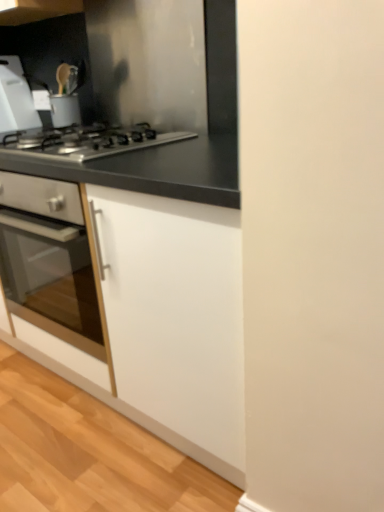
The image size is (384, 512). Describe the element at coordinates (144, 92) in the screenshot. I see `black matte countertop at upper left` at that location.

Locate an element on the screen. white plastic cutting board at upper left is located at coordinates click(15, 98).

From a real-world perspective, does white plastic cutting board at upper left stand above stainless steel gas stove at center?

Yes, from a real-world perspective, white plastic cutting board at upper left is over stainless steel gas stove at center

How different are the orientations of white plastic cutting board at upper left and stainless steel gas stove at center in degrees?

The facing directions of white plastic cutting board at upper left and stainless steel gas stove at center are 92.7 degrees apart.

Is white plastic cutting board at upper left surrounding stainless steel gas stove at center?

No, stainless steel gas stove at center is not a part of white plastic cutting board at upper left.

Can you confirm if white plastic cutting board at upper left is shorter than stainless steel gas stove at center?

No, white plastic cutting board at upper left is not shorter than stainless steel gas stove at center.

Consider the image. Considering the relative positions of white matte cabinet at center and white plastic cutting board at upper left in the image provided, is white matte cabinet at center to the right of white plastic cutting board at upper left from the viewer's perspective?

Yes.

Based on their sizes in the image, would you say white matte cabinet at center is bigger or smaller than white plastic cutting board at upper left?

Clearly, white matte cabinet at center is larger in size than white plastic cutting board at upper left.

Locate an element on the screen. cabinetry below the white plastic cutting board at upper left (from a real-world perspective) is located at coordinates click(142, 228).

Who is more distant, white matte cabinet at center or white plastic cutting board at upper left?

white plastic cutting board at upper left is more distant.

From the picture: Is stainless steel gas stove at center not within black matte countertop at upper left?

stainless steel gas stove at center is positioned outside black matte countertop at upper left.

Is stainless steel gas stove at center to the left or to the right of black matte countertop at upper left in the image?

stainless steel gas stove at center is to the left of black matte countertop at upper left.

From a real-world perspective, is stainless steel gas stove at center positioned over black matte countertop at upper left based on gravity?

No, from a real-world perspective, stainless steel gas stove at center is not on top of black matte countertop at upper left.

From a real-world perspective, is white plastic cutting board at upper left on white matte cabinet at center?

Indeed, from a real-world perspective, white plastic cutting board at upper left stands above white matte cabinet at center.

Does point (1, 69) appear closer or farther from the camera than point (226, 39)?

Clearly, point (1, 69) is more distant from the camera than point (226, 39).

Is white plastic cutting board at upper left beside white matte cabinet at center?

There is a gap between white plastic cutting board at upper left and white matte cabinet at center.

Which of these two, white plastic cutting board at upper left or white matte cabinet at center, stands shorter?

With less height is white plastic cutting board at upper left.

Based on the photo, which is in front, black matte countertop at upper left or white matte cabinet at center?

white matte cabinet at center is more forward.

Visually, is black matte countertop at upper left positioned to the left or to the right of white matte cabinet at center?

black matte countertop at upper left is positioned on white matte cabinet at center's right side.

Is white plastic cutting board at upper left facing towards black matte countertop at upper left?

Yes.

Measure the distance from white plastic cutting board at upper left to black matte countertop at upper left.

white plastic cutting board at upper left and black matte countertop at upper left are 20.18 inches apart from each other.

Is white plastic cutting board at upper left wider than black matte countertop at upper left?

Yes.

Can you tell me how much white matte cabinet at center and stainless steel gas stove at center differ in facing direction?

They differ by 0.453 degrees in their facing directions.

From the image's perspective, does white matte cabinet at center appear lower than stainless steel gas stove at center?

Indeed, from the image's perspective, white matte cabinet at center is shown beneath stainless steel gas stove at center.

Is stainless steel gas stove at center at the back of white matte cabinet at center?

No, white matte cabinet at center is not facing the opposite direction of stainless steel gas stove at center.

How much distance is there between white matte cabinet at center and stainless steel gas stove at center?

white matte cabinet at center and stainless steel gas stove at center are 13.13 inches apart.

What are the coordinates of `home appliance behind the stainless steel gas stove at center` in the screenshot? It's located at (15, 98).

Where is `home appliance that is on the left side of white matte cabinet at center`? This screenshot has width=384, height=512. home appliance that is on the left side of white matte cabinet at center is located at coordinates (15, 98).

Which object lies nearer to the anchor point black matte countertop at upper left, white plastic cutting board at upper left or stainless steel gas stove at center?

Based on the image, stainless steel gas stove at center appears to be nearer to black matte countertop at upper left.

Considering their positions, is white matte cabinet at center positioned closer to black matte countertop at upper left than stainless steel gas stove at center?

white matte cabinet at center lies closer to black matte countertop at upper left than the other object.

Looking at the image, which one is located further to stainless steel gas stove at center, white matte cabinet at center or black matte countertop at upper left?

Among the two, white matte cabinet at center is located further to stainless steel gas stove at center.

Looking at this image, considering their positions, is black matte countertop at upper left positioned further to white matte cabinet at center than white plastic cutting board at upper left?

white plastic cutting board at upper left.

Considering their positions, is stainless steel gas stove at center positioned further to white plastic cutting board at upper left than black matte countertop at upper left?

Based on the image, stainless steel gas stove at center appears to be further to white plastic cutting board at upper left.

Estimate the real-world distances between objects in this image. Which object is closer to black matte countertop at upper left, white matte cabinet at center or white plastic cutting board at upper left?

white matte cabinet at center is closer to black matte countertop at upper left.

Based on their spatial positions, is white plastic cutting board at upper left or white matte cabinet at center further from black matte countertop at upper left?

Among the two, white plastic cutting board at upper left is located further to black matte countertop at upper left.

Looking at the image, which one is located further to white matte cabinet at center, black matte countertop at upper left or stainless steel gas stove at center?

Among the two, stainless steel gas stove at center is located further to white matte cabinet at center.

I want to click on gas stove that lies between black matte countertop at upper left and white matte cabinet at center from top to bottom, so click(87, 142).

Locate an element on the screen. The width and height of the screenshot is (384, 512). countertop between stainless steel gas stove at center and white plastic cutting board at upper left in the front-back direction is located at coordinates (144, 92).

I want to click on home appliance between black matte countertop at upper left and white matte cabinet at center in the vertical direction, so click(x=15, y=98).

Find the location of a particular element. This screenshot has height=512, width=384. gas stove between white matte cabinet at center and white plastic cutting board at upper left in the front-back direction is located at coordinates coord(87,142).